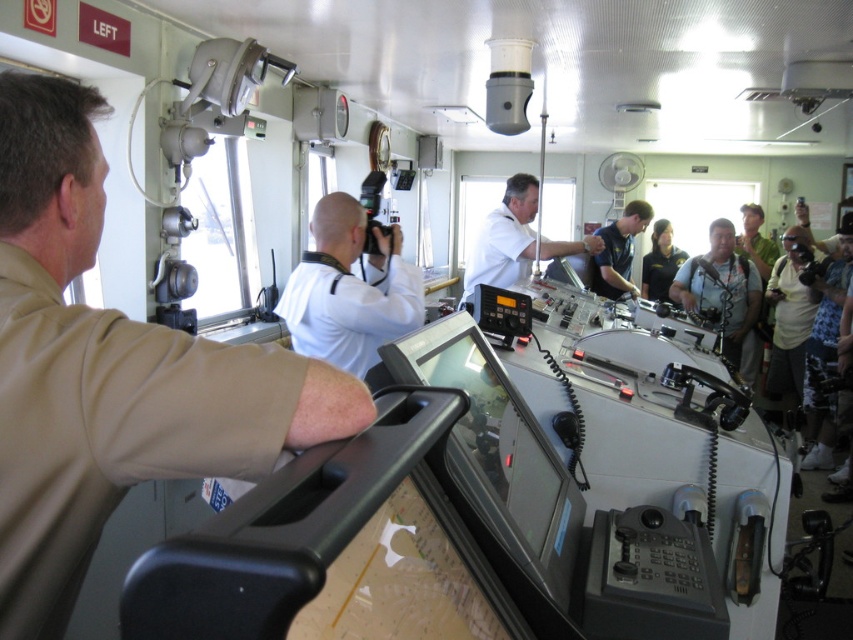
This screenshot has height=640, width=853. What do you see at coordinates (349, 291) in the screenshot? I see `white matte camera at center` at bounding box center [349, 291].

Which is in front, point (418, 273) or point (648, 218)?

Point (418, 273) is in front.

What are the coordinates of `white matte camera at center` in the screenshot? It's located at (349, 291).

Does white matte camera at center appear over white matte uniform at center?

No, white matte camera at center is not above white matte uniform at center.

Who is positioned more to the left, white matte camera at center or white matte uniform at center?

Positioned to the left is white matte camera at center.

Between point (350, 332) and point (468, 280), which one is positioned in front?

Point (350, 332) is more forward.

Locate an element on the screen. The width and height of the screenshot is (853, 640). white matte camera at center is located at coordinates (349, 291).

Which is below, matte khaki uniform at left or white matte camera at center?

matte khaki uniform at left is below.

Which is above, matte khaki uniform at left or white matte camera at center?

white matte camera at center is higher up.

I want to click on matte khaki uniform at left, so click(x=109, y=371).

Identify the location of matte khaki uniform at left. (109, 371).